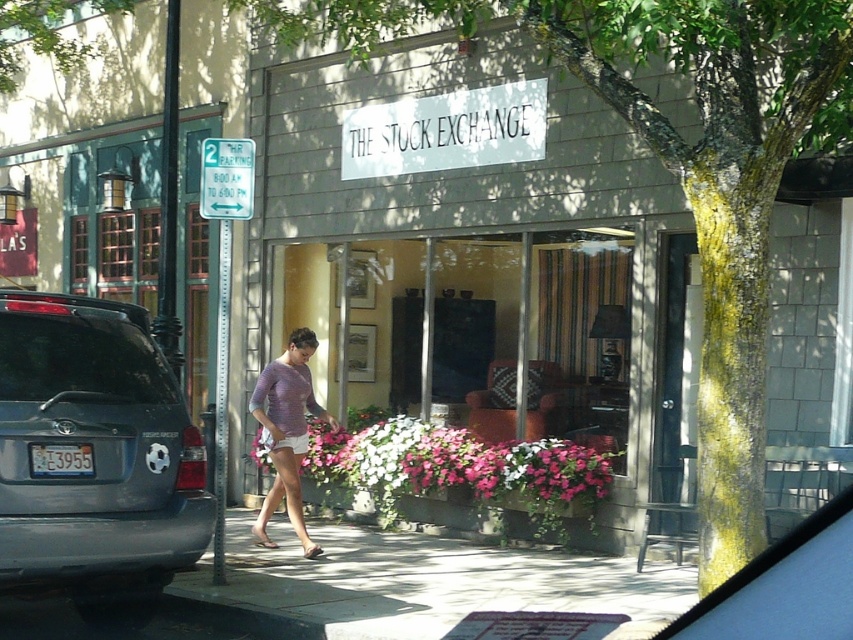
You are standing at the entrance of The Stock Exchange and want to walk to the smooth concrete sidewalk at center. Which direction should you move relative to the flower box in front of the store?

The smooth concrete sidewalk at center is located at point (418, 584). Since the flower box is in front of the store, you should move forward from the entrance towards the center of the image to reach the sidewalk.

You are a delivery person standing next to the gray matte suv at left and need to place a package at the matte gray storefront at center. Can you carry the package directly to the store without walking around any obstacles?

The distance between the matte gray storefront at center and the gray matte suv at left is 9.91 feet. Since there are no obstacles mentioned in the scene, you can walk directly to the store with the package.